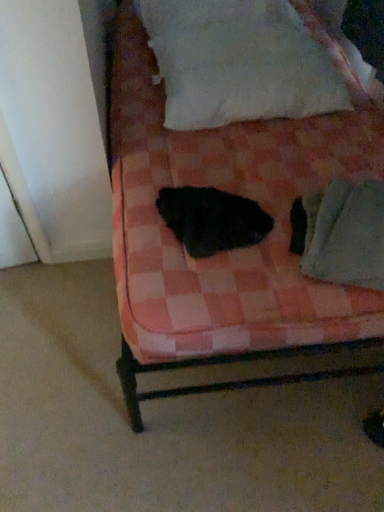
Question: Considering their positions, is pink checkered fabric at center located in front of or behind black fuzzy cat at center?

Choices:
 (A) front
 (B) behind

Answer: (A)

Question: Looking at their shapes, would you say pink checkered fabric at center is wider or thinner than black fuzzy cat at center?

Choices:
 (A) thin
 (B) wide

Answer: (B)

Question: Which of these objects is positioned closest to the black fuzzy cat at center?

Choices:
 (A) pink checkered fabric at center
 (B) white cotton pillow at upper center
 (C) green fabric at lower right

Answer: (C)

Question: Which is farther from the green fabric at lower right?

Choices:
 (A) black fuzzy cat at center
 (B) pink checkered fabric at center
 (C) white cotton pillow at upper center

Answer: (C)